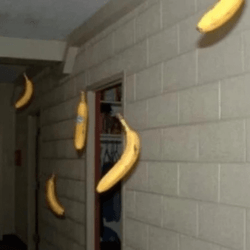
Where is `outlet`? outlet is located at coordinates (36, 236).